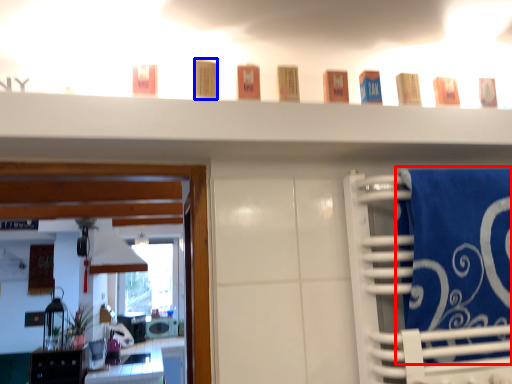
Question: Which of the following is the closest to the observer, bath towel (highlighted by a red box) or toiletry (highlighted by a blue box)?

Choices:
 (A) bath towel
 (B) toiletry

Answer: (A)